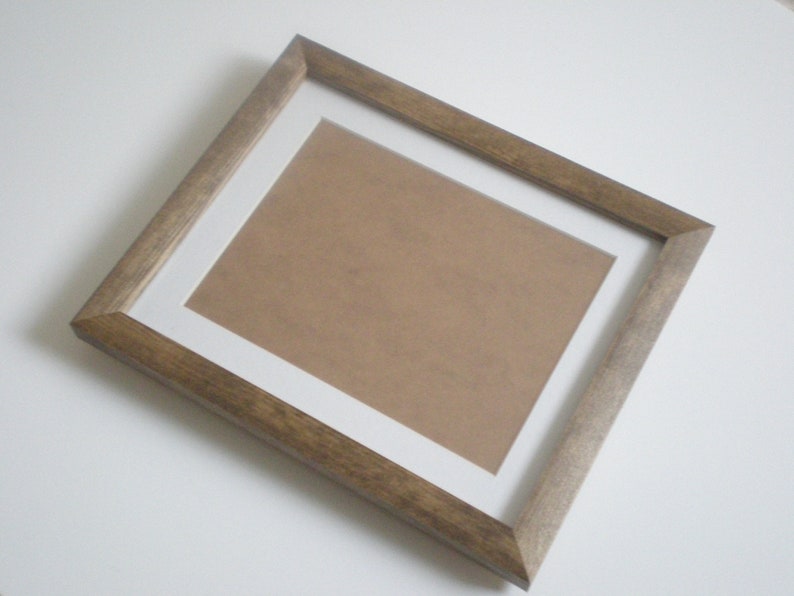
Find the location of a particular element. The width and height of the screenshot is (794, 596). corner of frame is located at coordinates (297, 35), (712, 225), (523, 586), (71, 330).